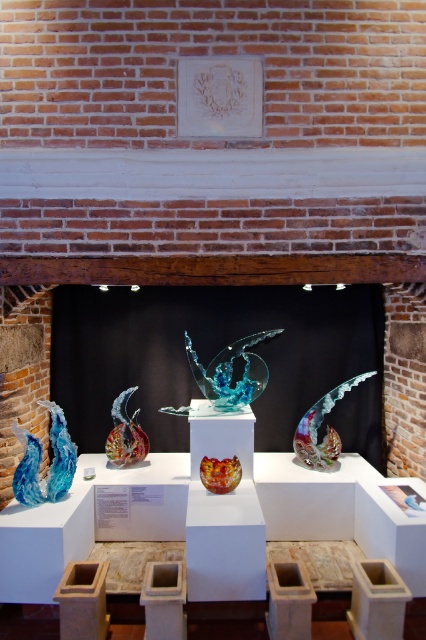
Does translucent blue glass sculpture at left have a lesser height compared to multicolored glass sculpture at center?

Incorrect, translucent blue glass sculpture at left's height does not fall short of multicolored glass sculpture at center's.

Which is more to the left, translucent blue glass sculpture at left or multicolored glass sculpture at center?

Positioned to the left is translucent blue glass sculpture at left.

Where is `translucent blue glass sculpture at left`? The image size is (426, 640). translucent blue glass sculpture at left is located at coordinates (40, 458).

Is translucent glass sculpture at right shorter than translucent amber glass bowl at center?

Incorrect, translucent glass sculpture at right's height does not fall short of translucent amber glass bowl at center's.

Who is shorter, translucent glass sculpture at right or translucent amber glass bowl at center?

translucent amber glass bowl at center is shorter.

Is point (327, 460) positioned in front of point (207, 480)?

No.

Where is `translucent glass sculpture at right`? The height and width of the screenshot is (640, 426). translucent glass sculpture at right is located at coordinates (319, 426).

Does translucent glass wave at center have a smaller size compared to translucent amber glass bowl at center?

No.

Does translucent glass wave at center come in front of translucent amber glass bowl at center?

No, it is behind translucent amber glass bowl at center.

The height and width of the screenshot is (640, 426). I want to click on translucent glass wave at center, so click(230, 372).